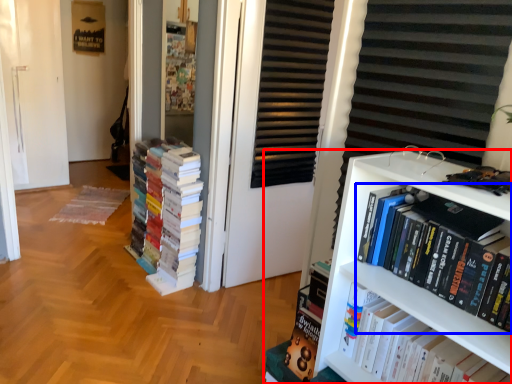
Question: Which point is closer to the camera, bookcase (highlighted by a red box) or book (highlighted by a blue box)?

Choices:
 (A) bookcase
 (B) book

Answer: (B)